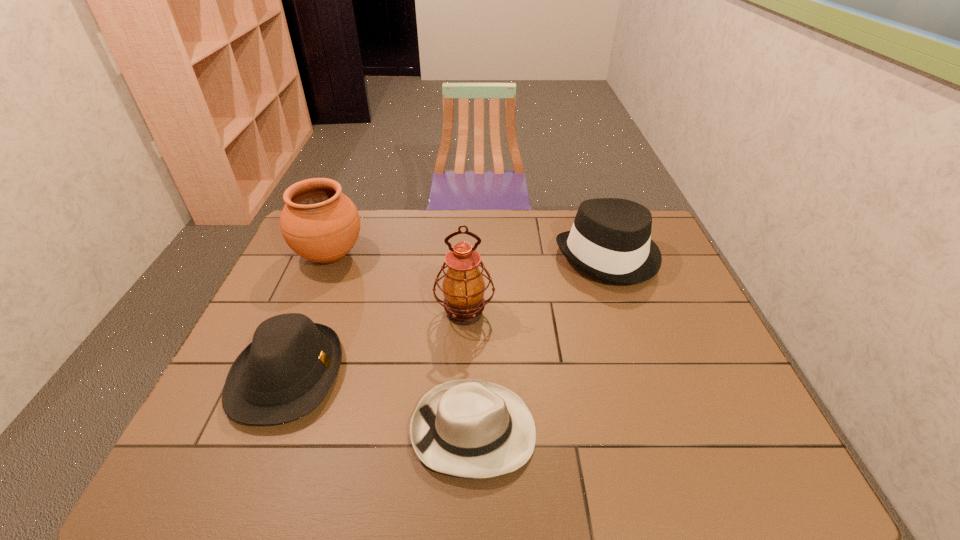
The width and height of the screenshot is (960, 540). Identify the location of vacant space located on the front of the rightmost fedora. (641, 348).

You are a GUI agent. You are given a task and a screenshot of the screen. Output one action in this format:
    pyautogui.click(x=<x>, y=<y>)
    Task: Click on the vacant area situated on the front-facing side of the second tallest fedora
    
    Given the screenshot: What is the action you would take?
    pyautogui.click(x=421, y=375)

In order to click on free space located on the front-facing side of the second fedora from right to left in this screenshot , I will do `click(589, 430)`.

Find the location of `pottery at the far edge`. pottery at the far edge is located at coordinates (318, 222).

At what (x,y) coordinates should I click in order to perform the action: click on fedora positioned at the far edge. Please return your answer as a coordinate pair (x, y). The image size is (960, 540). Looking at the image, I should click on (610, 239).

I want to click on object present at the near edge, so click(469, 428).

Image resolution: width=960 pixels, height=540 pixels. Identify the location of pottery positioned at the left edge. (318, 222).

In order to click on fedora located at the left edge in this screenshot , I will do `click(286, 371)`.

Locate an element on the screen. This screenshot has height=540, width=960. object that is at the right edge is located at coordinates (610, 239).

Locate an element on the screen. object at the far left corner is located at coordinates (318, 222).